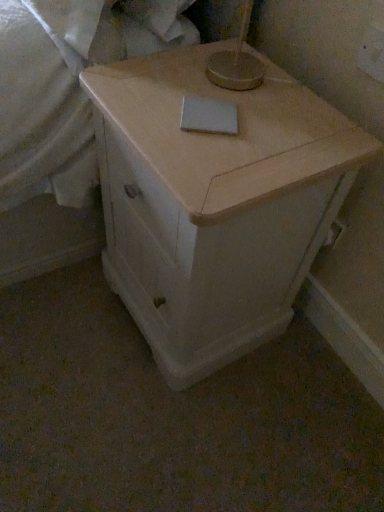
At what (x,y) coordinates should I click in order to perform the action: click on vacant area that is situated to the right of white matte notepad at center. Please return your answer as a coordinate pair (x, y). The image size is (384, 512). Looking at the image, I should click on (291, 123).